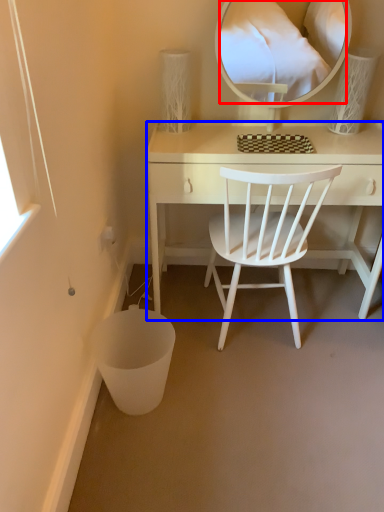
Question: Which point is further to the camera, mirror (highlighted by a red box) or desk (highlighted by a blue box)?

Choices:
 (A) mirror
 (B) desk

Answer: (B)